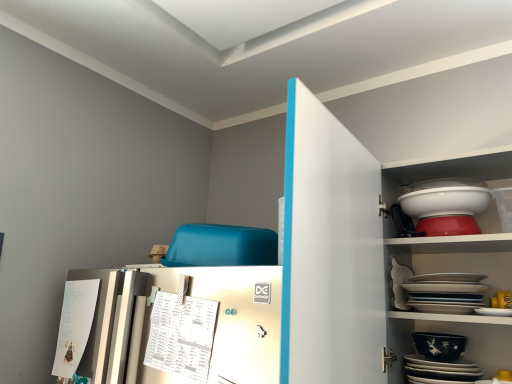
Question: From a real-world perspective, is black glossy bowl at lower right, placed as the 1th bowl when sorted from bottom to top, physically located above or below white glossy platter at upper right, the first platter when ordered from top to bottom?

Choices:
 (A) below
 (B) above

Answer: (A)

Question: From the image's perspective, relative to white glossy platter at upper right, the first platter when ordered from top to bottom, is black glossy bowl at lower right, placed as the 1th bowl when sorted from bottom to top, above or below?

Choices:
 (A) below
 (B) above

Answer: (A)

Question: Which is nearer to the white glossy platter at upper right, the first platter when ordered from top to bottom?

Choices:
 (A) black glossy bowl at lower right, placed as the 1th bowl when sorted from bottom to top
 (B) white glossy bowl at upper right, which is the first bowl in top-to-bottom order
 (C) black glossy platter at lower right, the second platter positioned from the top
 (D) white glossy cabinet at upper right

Answer: (A)

Question: Estimate the real-world distances between objects in this image. Which object is farther from the white glossy bowl at upper right, the second bowl ordered from the bottom?

Choices:
 (A) white glossy cabinet at upper right
 (B) black glossy platter at lower right, which ranks as the 1th platter in bottom-to-top order
 (C) white glossy platter at upper right, the first platter when ordered from top to bottom
 (D) black glossy bowl at lower right, the second bowl viewed from the top

Answer: (B)